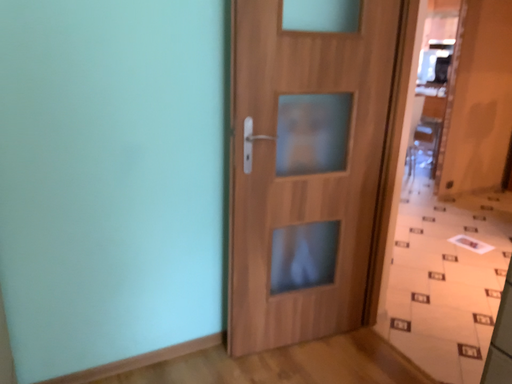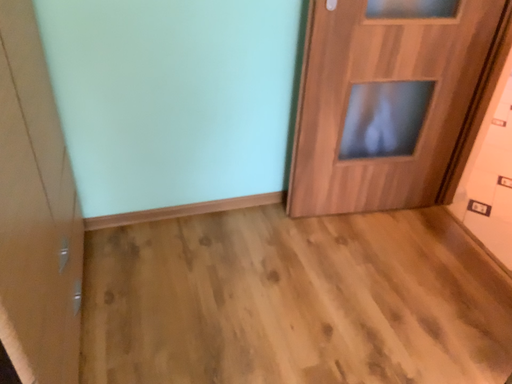
Question: How did the camera likely rotate when shooting the video?

Choices:
 (A) rotated right
 (B) rotated left

Answer: (B)